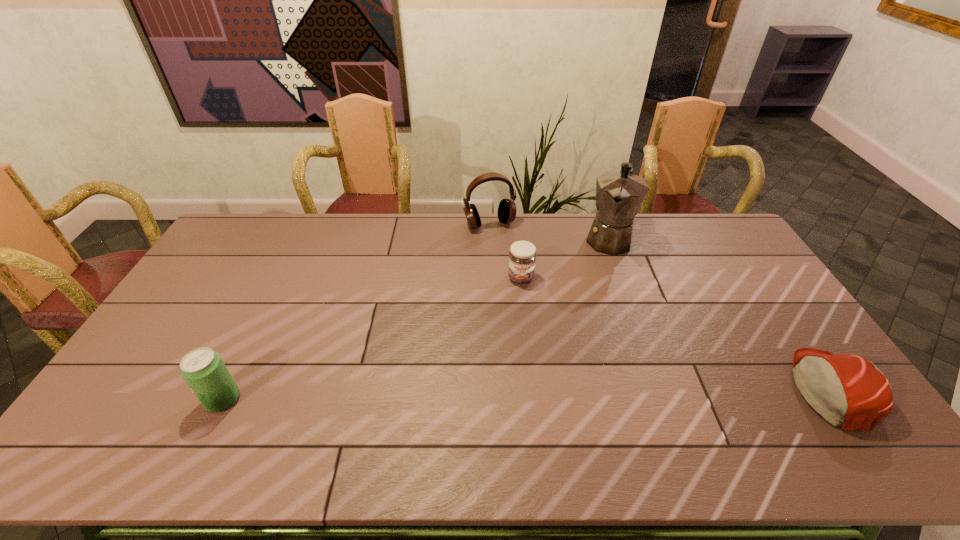
This screenshot has width=960, height=540. What are the coordinates of `cap at the near edge` in the screenshot? It's located at (848, 391).

Find the location of a particular element. Image resolution: width=960 pixels, height=540 pixels. object situated at the right edge is located at coordinates (848, 391).

The width and height of the screenshot is (960, 540). What are the coordinates of `object situated at the near right corner` in the screenshot? It's located at (848, 391).

The image size is (960, 540). In the image, there is a desktop. Find the location of `vacant space at the far edge`. vacant space at the far edge is located at coordinates (297, 215).

This screenshot has width=960, height=540. Find the location of `vacant space at the near edge of the desktop`. vacant space at the near edge of the desktop is located at coordinates (745, 414).

Where is `free region at the left edge of the desktop`? The height and width of the screenshot is (540, 960). free region at the left edge of the desktop is located at coordinates (152, 360).

In the image, there is a desktop. Identify the location of free region at the right edge. The width and height of the screenshot is (960, 540). (763, 357).

The height and width of the screenshot is (540, 960). Identify the location of vacant space at the far right corner of the desktop. (707, 240).

This screenshot has width=960, height=540. Identify the location of free point between the rightmost object and the fourth shortest object. (660, 307).

Identify the location of vacant area that lies between the cap and the fourth shortest object. (660, 307).